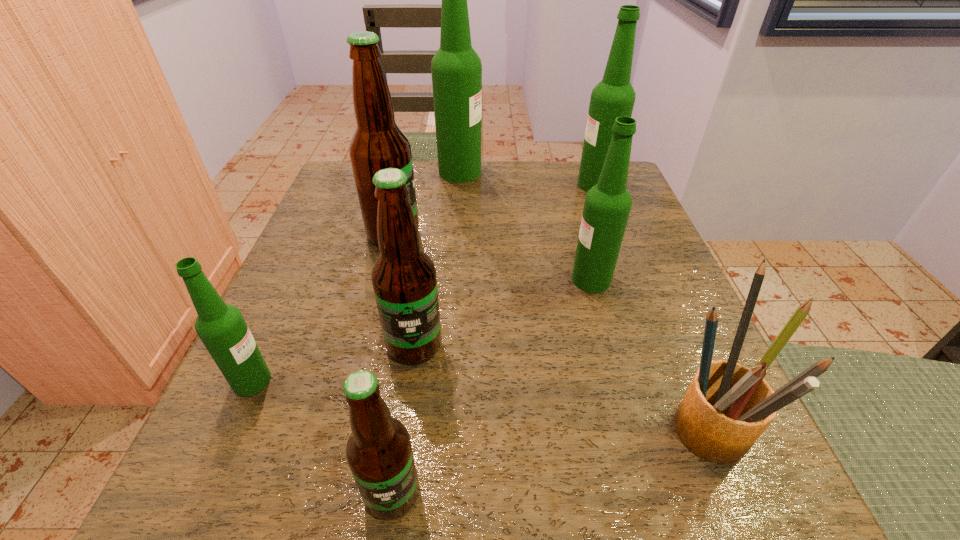
In the image, there is a desktop. In order to click on vacant space at the near edge in this screenshot , I will do `click(479, 451)`.

Locate an element on the screen. The image size is (960, 540). free space at the left edge of the desktop is located at coordinates (363, 222).

In the image, there is a desktop. Where is `vacant space at the right edge`? This screenshot has width=960, height=540. vacant space at the right edge is located at coordinates (649, 300).

In the image, there is a desktop. Where is `vacant space at the far left corner`? vacant space at the far left corner is located at coordinates (338, 175).

In the image, there is a desktop. In order to click on vacant space at the near left corner in this screenshot , I will do (240, 474).

Image resolution: width=960 pixels, height=540 pixels. In the image, there is a desktop. Identify the location of vacant space at the near right corner. (727, 504).

The width and height of the screenshot is (960, 540). What are the coordinates of `free area in between the fifth nearest beer bottle and the smallest brown beer bottle` in the screenshot? It's located at (393, 363).

The height and width of the screenshot is (540, 960). What are the coordinates of `vacant area that lies between the leftmost green beer bottle and the brown pencil box` in the screenshot? It's located at (476, 401).

Locate an element on the screen. vacant region between the leftmost object and the smallest brown beer bottle is located at coordinates (323, 437).

I want to click on empty space that is in between the fifth nearest object and the second farthest brown beer bottle, so click(503, 312).